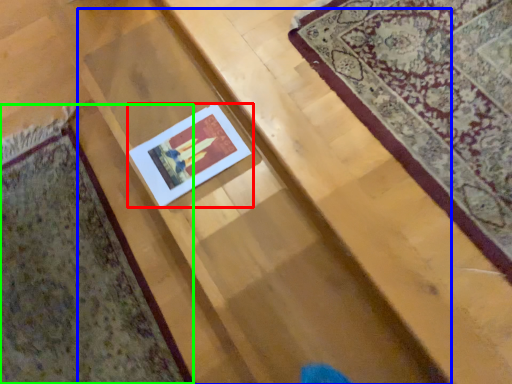
Question: Which object is positioned closest to picture frame (highlighted by a red box)? Select from stairwell (highlighted by a blue box) and mat (highlighted by a green box).

Choices:
 (A) stairwell
 (B) mat

Answer: (A)